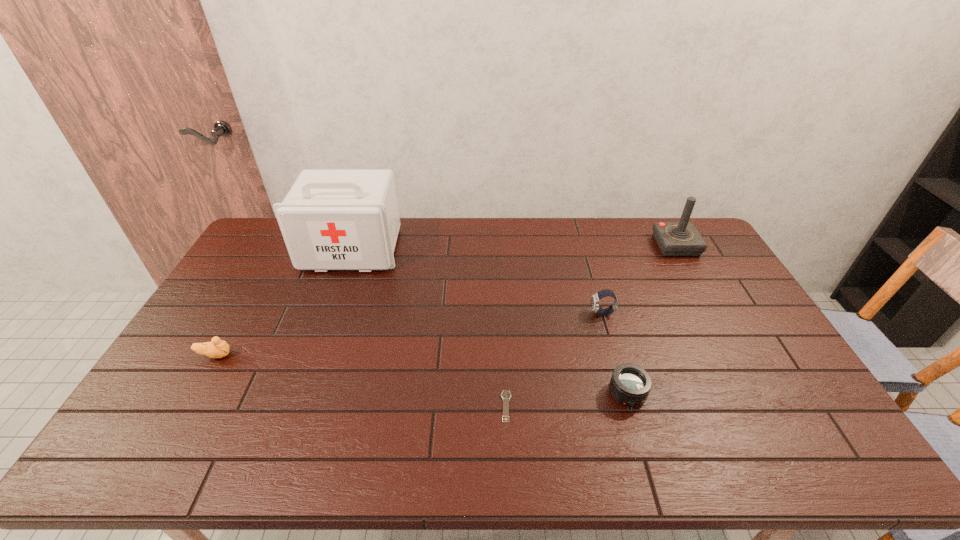
This screenshot has height=540, width=960. Identify the location of joystick at the far edge. (681, 238).

Identify the location of object at the left edge. Image resolution: width=960 pixels, height=540 pixels. (218, 348).

Where is `object present at the right edge`? object present at the right edge is located at coordinates (681, 238).

At what (x,y) coordinates should I click in order to perform the action: click on object positioned at the far right corner. Please return your answer as a coordinate pair (x, y). The height and width of the screenshot is (540, 960). Looking at the image, I should click on (681, 238).

Identify the location of vacant area at the far edge. (453, 220).

This screenshot has height=540, width=960. In the image, there is a desktop. What are the coordinates of `blank space at the left edge` in the screenshot? It's located at (258, 301).

At what (x,y) coordinates should I click in order to perform the action: click on vacant area at the right edge. Please return your answer as a coordinate pair (x, y). The image size is (960, 540). Looking at the image, I should click on (696, 271).

Locate an element on the screen. vacant region at the near left corner of the desktop is located at coordinates (146, 458).

In the image, there is a desktop. Find the location of `vacant space at the near right corner`. vacant space at the near right corner is located at coordinates (837, 449).

At what (x,y) coordinates should I click in order to perform the action: click on vacant area that lies between the second object from left to right and the telephoto lens. Please return your answer as a coordinate pair (x, y). This screenshot has height=540, width=960. Looking at the image, I should click on (490, 321).